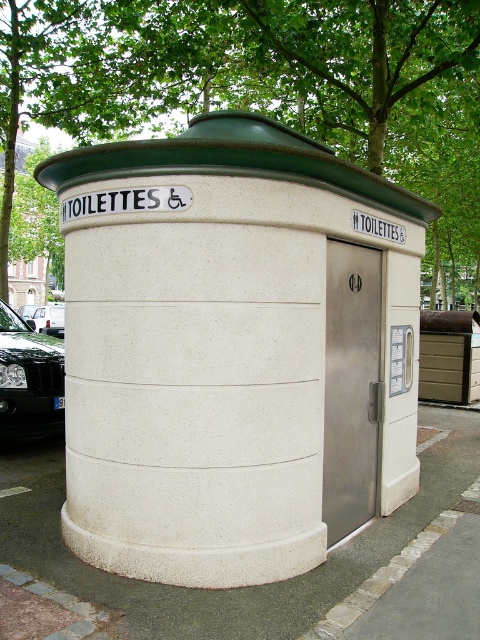
Question: Can you confirm if white concrete pavement at lower center is positioned below shiny black car at left?

Choices:
 (A) yes
 (B) no

Answer: (A)

Question: Does white concrete toilettes at center appear under white concrete pavement at lower center?

Choices:
 (A) no
 (B) yes

Answer: (A)

Question: Can you confirm if white concrete toilettes at center is positioned to the left of white concrete pavement at lower center?

Choices:
 (A) yes
 (B) no

Answer: (B)

Question: Based on their relative distances, which object is farther from the white concrete pavement at lower center?

Choices:
 (A) shiny black car at left
 (B) white concrete toilettes at center
 (C) green leafy tree at upper center

Answer: (A)

Question: Which object is farther from the camera taking this photo?

Choices:
 (A) white concrete pavement at lower center
 (B) shiny black car at lower left

Answer: (B)

Question: Which point appears farthest from the camera in this image?

Choices:
 (A) (76, 577)
 (B) (9, 392)
 (C) (57, 312)
 (D) (231, 52)

Answer: (C)